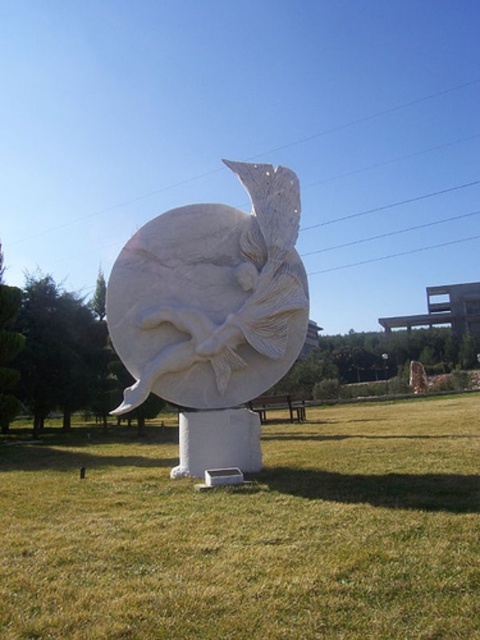
Question: Which object is positioned closest to the brown wooden bench at center?

Choices:
 (A) green grass at center
 (B) white marble sculpture at center

Answer: (A)

Question: Which object is positioned farthest from the brown wooden bench at center?

Choices:
 (A) white marble sculpture at center
 (B) green grass at center

Answer: (A)

Question: Which point is closer to the camera?

Choices:
 (A) brown wooden bench at center
 (B) white marble sculpture at center

Answer: (B)

Question: Can you confirm if green grass at center is wider than brown wooden bench at center?

Choices:
 (A) yes
 (B) no

Answer: (A)

Question: Is green grass at center below brown wooden bench at center?

Choices:
 (A) no
 (B) yes

Answer: (A)

Question: Can you confirm if green grass at center is positioned below brown wooden bench at center?

Choices:
 (A) no
 (B) yes

Answer: (A)